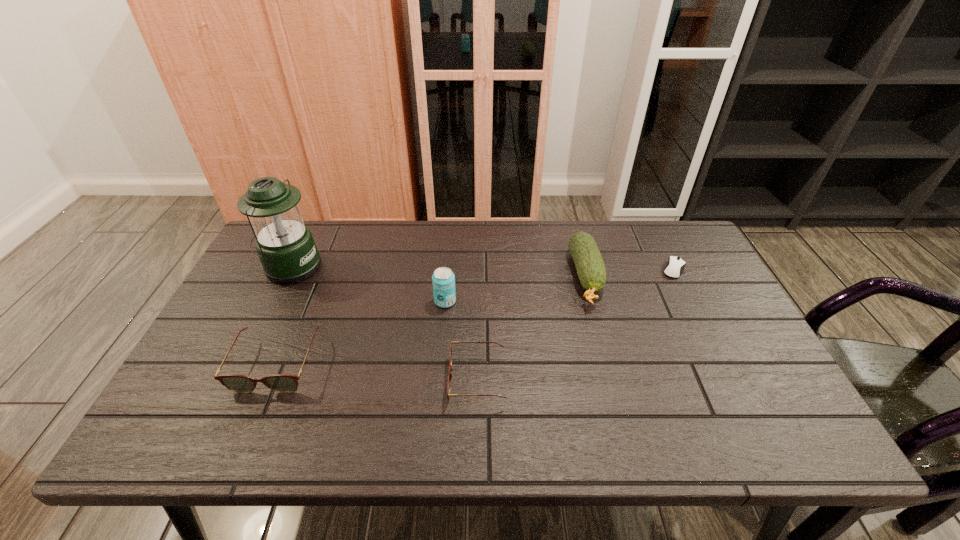
Where is `vacant space that's between the fifth shortest object and the third shortest object`? vacant space that's between the fifth shortest object and the third shortest object is located at coordinates (361, 333).

The height and width of the screenshot is (540, 960). I want to click on vacant region between the beer can and the fourth tallest object, so click(361, 333).

You are a GUI agent. You are given a task and a screenshot of the screen. Output one action in this format:
    pyautogui.click(x=<x>, y=<y>)
    Task: Click on the vacant area that lies between the cucumber and the taller spectacles
    
    Given the screenshot: What is the action you would take?
    pyautogui.click(x=431, y=320)

Locate an element on the screen. This screenshot has width=960, height=540. object that can be found as the fifth closest to the second shortest object is located at coordinates (675, 266).

The height and width of the screenshot is (540, 960). Find the location of `object that can be found as the second closest to the third tallest object`. object that can be found as the second closest to the third tallest object is located at coordinates (451, 342).

Identify the location of free space that satisfies the following two spatial constraints: 1. on the front side of the mouse; 2. at the front view of the second shortest object. [x=729, y=380].